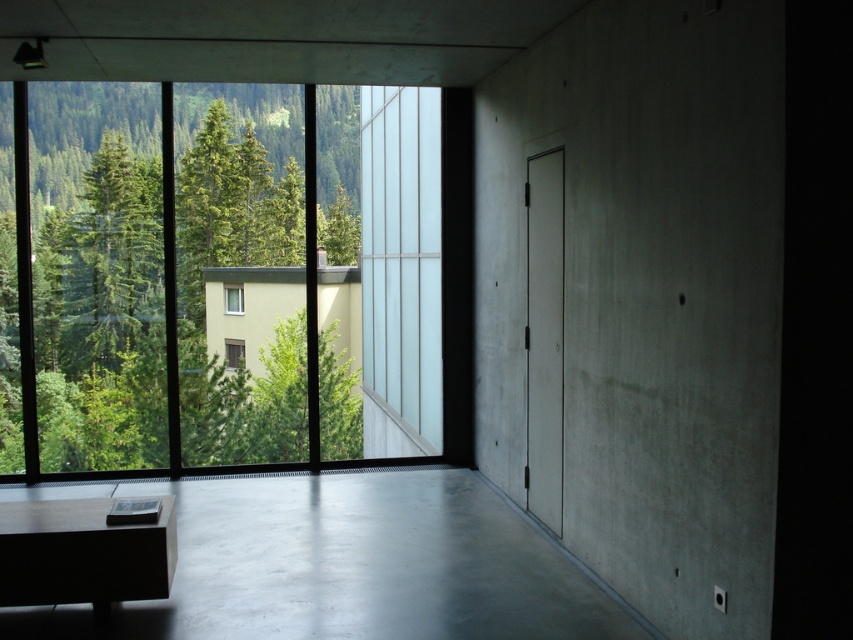
Question: Observing the image, what is the correct spatial positioning of green leafy tree at left in reference to clear glass window at center?

Choices:
 (A) left
 (B) right

Answer: (A)

Question: Among these objects, which one is nearest to the camera?

Choices:
 (A) green leafy tree at left
 (B) clear glass window at center
 (C) white plastic window at center

Answer: (A)

Question: Among these points, which one is nearest to the camera?

Choices:
 (A) (437, 538)
 (B) (332, 196)
 (C) (234, 353)
 (D) (228, 296)

Answer: (A)

Question: Which point appears closest to the camera in this image?

Choices:
 (A) (231, 371)
 (B) (229, 307)
 (C) (236, 365)
 (D) (381, 541)

Answer: (D)

Question: Can you confirm if clear glass window at center is thinner than white plastic window at center?

Choices:
 (A) yes
 (B) no

Answer: (B)

Question: From the image, what is the correct spatial relationship of green leafy tree at left in relation to white plastic window at center?

Choices:
 (A) above
 (B) below

Answer: (A)